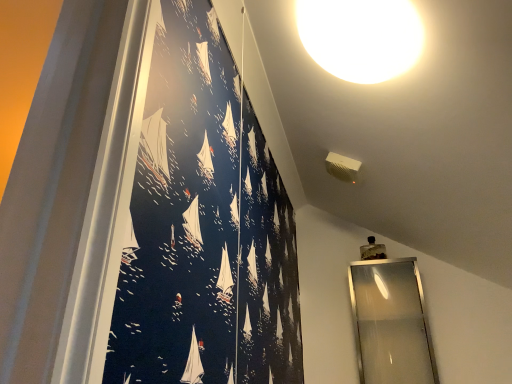
Question: Can you confirm if white glossy light fixture at upper center is shorter than silver metallic mirror at right?

Choices:
 (A) yes
 (B) no

Answer: (A)

Question: Is white glossy light fixture at upper center further to the viewer compared to silver metallic mirror at right?

Choices:
 (A) yes
 (B) no

Answer: (B)

Question: From the image's perspective, would you say white glossy light fixture at upper center is shown under silver metallic mirror at right?

Choices:
 (A) no
 (B) yes

Answer: (A)

Question: Could you tell me if white glossy light fixture at upper center is facing silver metallic mirror at right?

Choices:
 (A) yes
 (B) no

Answer: (B)

Question: Is white glossy light fixture at upper center touching silver metallic mirror at right?

Choices:
 (A) yes
 (B) no

Answer: (B)

Question: From a real-world perspective, is white glossy light fixture at upper center over silver metallic mirror at right?

Choices:
 (A) yes
 (B) no

Answer: (A)

Question: Is silver metallic mirror at right positioned beyond the bounds of white glossy light fixture at upper center?

Choices:
 (A) no
 (B) yes

Answer: (B)

Question: Is silver metallic mirror at right wider than white glossy light fixture at upper center?

Choices:
 (A) no
 (B) yes

Answer: (A)

Question: Is silver metallic mirror at right directly adjacent to white glossy light fixture at upper center?

Choices:
 (A) no
 (B) yes

Answer: (A)

Question: Can you confirm if silver metallic mirror at right is smaller than white glossy light fixture at upper center?

Choices:
 (A) no
 (B) yes

Answer: (A)

Question: Is silver metallic mirror at right far away from white glossy light fixture at upper center?

Choices:
 (A) yes
 (B) no

Answer: (A)

Question: Can you confirm if silver metallic mirror at right is bigger than white glossy light fixture at upper center?

Choices:
 (A) yes
 (B) no

Answer: (A)

Question: From the image's perspective, is white glossy light fixture at upper center above or below silver metallic mirror at right?

Choices:
 (A) below
 (B) above

Answer: (B)